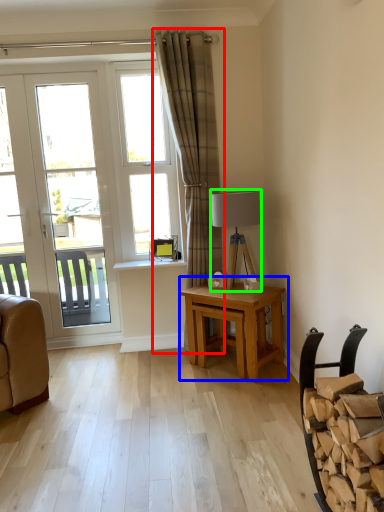
Question: Considering the real-world distances, which object is closest to curtain (highlighted by a red box)? table (highlighted by a blue box) or lamp (highlighted by a green box).

Choices:
 (A) table
 (B) lamp

Answer: (B)